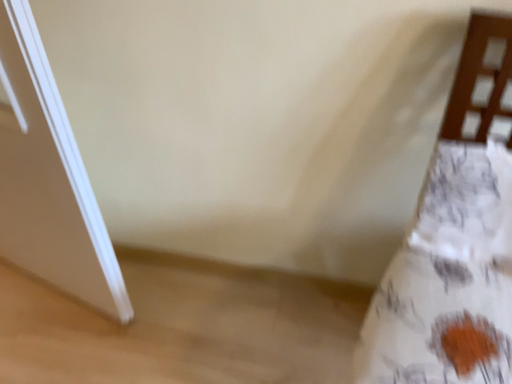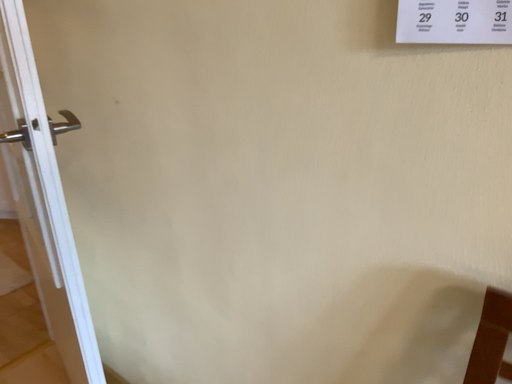
Question: How did the camera likely rotate when shooting the video?

Choices:
 (A) rotated upward
 (B) rotated downward

Answer: (A)